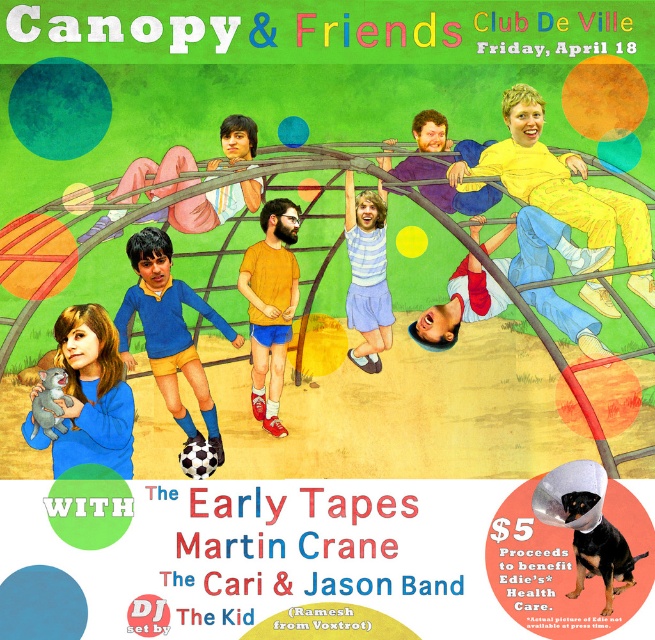
You are standing at the entrance of the playground structure and want to reach the point marked at coordinates point (519, 160). If your walking speed is 3 feet per second, how long will it take you to reach that point?

The distance of point (519, 160) from camera is 172.93 feet. At a walking speed of 3 feet per second, it will take approximately 57.64 seconds to reach the point.

You are designing a new poster layout and want to ensure that both the white cotton shirt at center and the blue jersey at center are clearly visible. Given their sizes, which one might require more space in the design to maintain clarity?

The white cotton shirt at center has a greater width than the blue jersey at center, so it would require more space in the design to maintain clarity.

You are designing a layout for a magazine article about the Canopy Club. The article will feature two key elements from the poster. You need to place the yellow matte pants at upper right and the blue jersey at center in a vertical column. Which element should be placed higher up in the column to maintain the height relationship shown in the original poster?

The yellow matte pants at upper right should be placed higher up in the column because it has a lesser height compared to the blue jersey at center, so positioning it higher maintains the original height relationship where the shorter element is above the taller one.